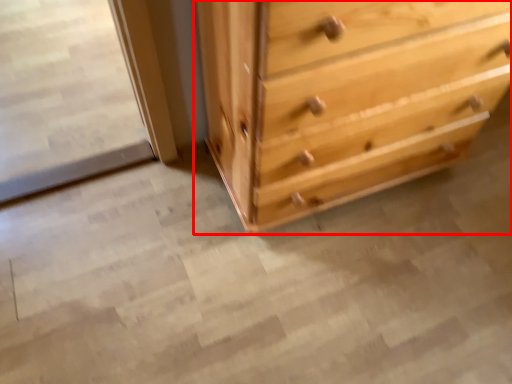
Question: From the image's perspective, what is the correct spatial positioning of chest of drawers (annotated by the red box) in reference to screen door?

Choices:
 (A) above
 (B) below

Answer: (B)